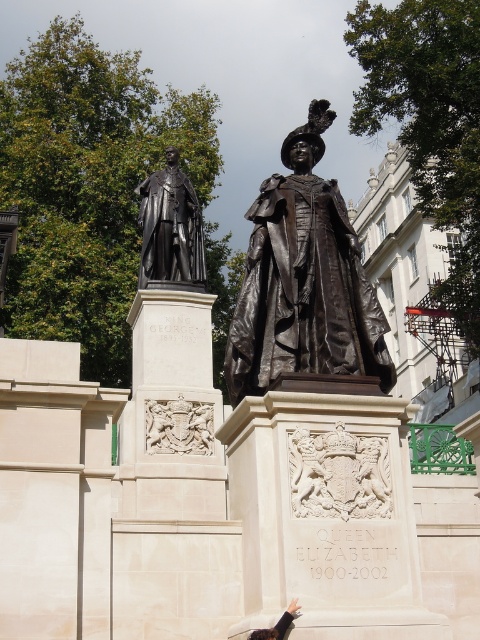
Can you confirm if bronze statue at center is positioned to the left of bronze statue at left?

Incorrect, bronze statue at center is not on the left side of bronze statue at left.

Between point (312, 369) and point (164, 188), which one is positioned in front?

Point (312, 369) is more forward.

This screenshot has width=480, height=640. I want to click on bronze statue at center, so click(x=303, y=280).

Identify the location of bronze statue at center. The width and height of the screenshot is (480, 640). (303, 280).

Who is shorter, bronze statue at center or black leather glove at lower center?

With less height is black leather glove at lower center.

In order to click on bronze statue at center in this screenshot , I will do `click(303, 280)`.

You are a GUI agent. You are given a task and a screenshot of the screen. Output one action in this format:
    pyautogui.click(x=<x>, y=<y>)
    Task: Click on the bronze statue at left
    The width and height of the screenshot is (480, 640).
    Given the screenshot: What is the action you would take?
    pyautogui.click(x=170, y=230)

What do you see at coordinates (170, 230) in the screenshot? I see `bronze statue at left` at bounding box center [170, 230].

At what (x,y) coordinates should I click in order to perform the action: click on bronze statue at left. Please return your answer as a coordinate pair (x, y). Looking at the image, I should click on (170, 230).